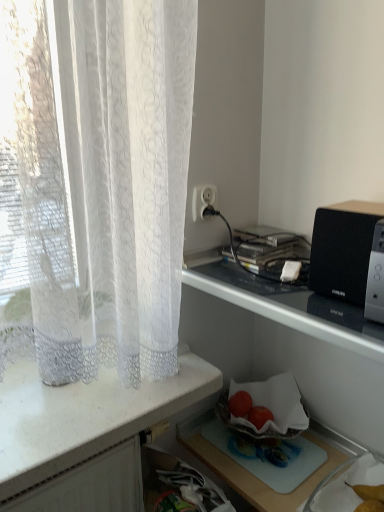
In order to click on vacant area that is in front of smooth red strawberries at center, which is the second fruit from left to right in this screenshot , I will do `click(273, 458)`.